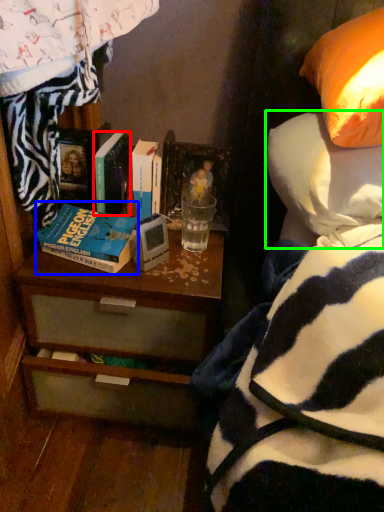
Question: Considering the real-world distances, which object is closest to book (highlighted by a red box)? book (highlighted by a blue box) or pillow (highlighted by a green box).

Choices:
 (A) book
 (B) pillow

Answer: (A)